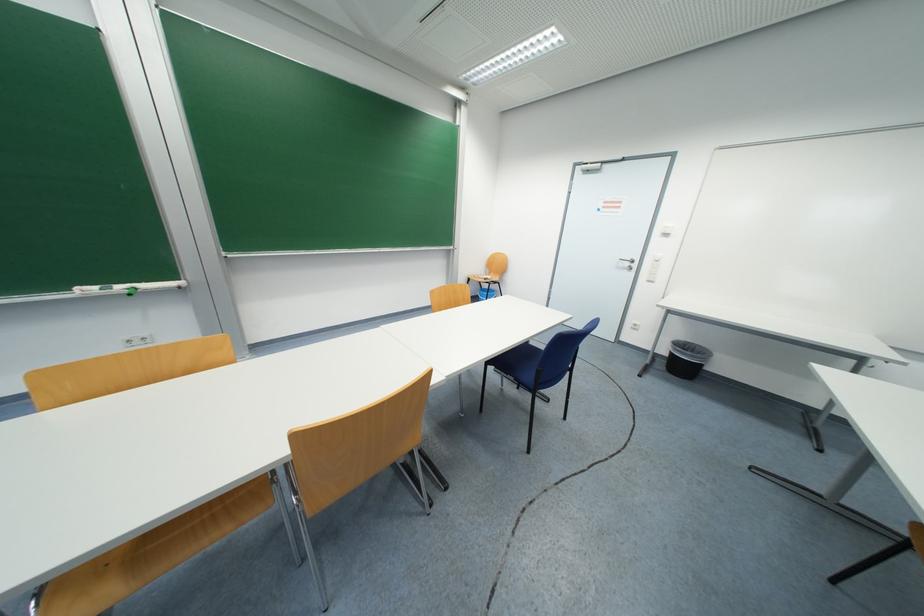
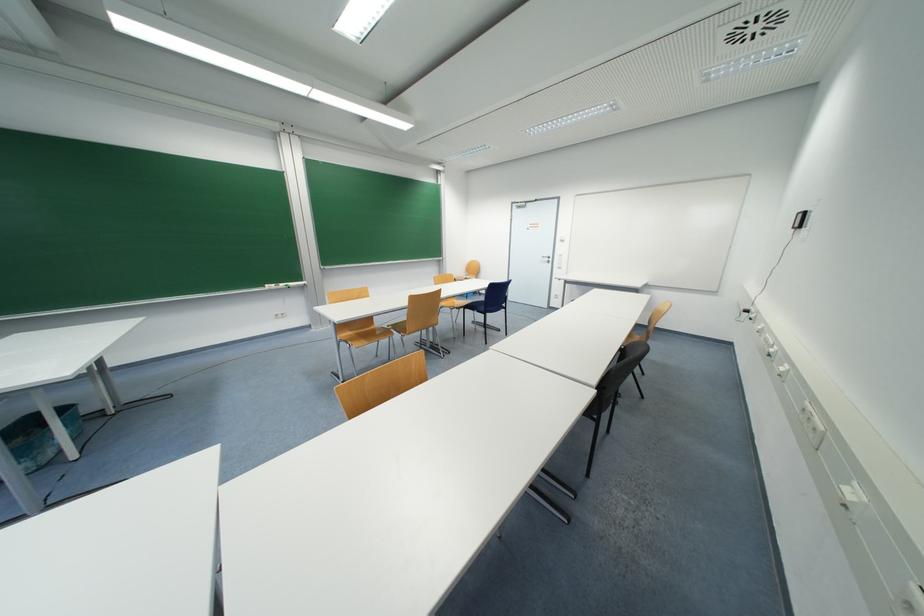
Question: The images are taken continuously from a first-person perspective. In which direction are you moving?

Choices:
 (A) Left
 (B) Right
 (C) Forward
 (D) Backward

Answer: (D)